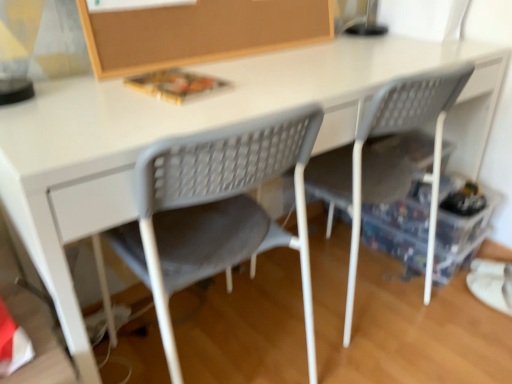
Question: Does burlap board at upper center have a lesser height compared to gray plastic chair at center, which appears as the 1th chair when viewed from the right?

Choices:
 (A) yes
 (B) no

Answer: (A)

Question: Can we say burlap board at upper center lies outside gray plastic chair at center, the second chair positioned from the left?

Choices:
 (A) yes
 (B) no

Answer: (A)

Question: From a real-world perspective, is burlap board at upper center physically above gray plastic chair at center, which appears as the 1th chair when viewed from the right?

Choices:
 (A) no
 (B) yes

Answer: (B)

Question: Can gray plastic chair at center, which appears as the 1th chair when viewed from the right, be found inside burlap board at upper center?

Choices:
 (A) no
 (B) yes

Answer: (A)

Question: Does burlap board at upper center have a larger size compared to gray plastic chair at center, which appears as the 1th chair when viewed from the right?

Choices:
 (A) yes
 (B) no

Answer: (B)

Question: Looking at the image, does gray plastic chair at center, which appears as the 1th chair when viewed from the right, seem bigger or smaller compared to transparent plastic storage box at lower right?

Choices:
 (A) big
 (B) small

Answer: (A)

Question: Considering the positions of point (352, 233) and point (482, 221), is point (352, 233) closer or farther from the camera than point (482, 221)?

Choices:
 (A) closer
 (B) farther

Answer: (A)

Question: Would you say gray plastic chair at center, the second chair positioned from the left, is to the left or to the right of transparent plastic storage box at lower right in the picture?

Choices:
 (A) right
 (B) left

Answer: (B)

Question: From the image's perspective, is gray plastic chair at center, the second chair positioned from the left, above or below transparent plastic storage box at lower right?

Choices:
 (A) below
 (B) above

Answer: (B)

Question: Is burlap board at upper center in front of or behind gray mesh chair at center, marked as the 1th chair in a left-to-right arrangement, in the image?

Choices:
 (A) behind
 (B) front

Answer: (A)

Question: Is burlap board at upper center spatially inside gray mesh chair at center, the second chair when ordered from right to left, or outside of it?

Choices:
 (A) outside
 (B) inside

Answer: (A)

Question: Considering the positions of point (154, 54) and point (173, 220), is point (154, 54) closer or farther from the camera than point (173, 220)?

Choices:
 (A) closer
 (B) farther

Answer: (B)

Question: Based on their sizes in the image, would you say burlap board at upper center is bigger or smaller than gray mesh chair at center, marked as the 1th chair in a left-to-right arrangement?

Choices:
 (A) small
 (B) big

Answer: (A)

Question: In the image, is gray plastic chair at center, which appears as the 1th chair when viewed from the right, positioned in front of or behind gray mesh chair at center, the second chair when ordered from right to left?

Choices:
 (A) front
 (B) behind

Answer: (B)

Question: Is gray plastic chair at center, the second chair positioned from the left, taller or shorter than gray mesh chair at center, the second chair when ordered from right to left?

Choices:
 (A) short
 (B) tall

Answer: (B)